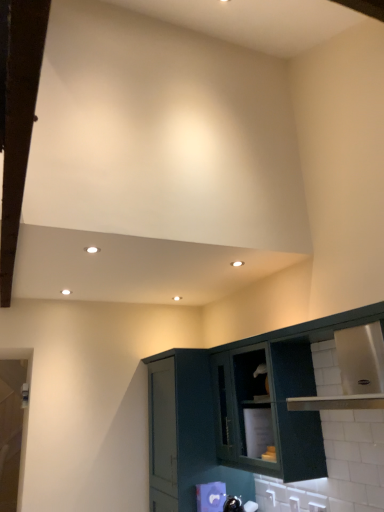
Question: From a real-world perspective, is white plastic electric outlet at lower right, placed as the third electric outlet when sorted from front to back, on stainless steel cabinet at lower right, marked as the 1th cabinetry in a right-to-left arrangement?

Choices:
 (A) yes
 (B) no

Answer: (B)

Question: Is white plastic electric outlet at lower right, the 1th electric outlet when ordered from back to front, oriented towards stainless steel cabinet at lower right, which is the second cabinetry from left to right?

Choices:
 (A) yes
 (B) no

Answer: (A)

Question: Is white plastic electric outlet at lower right, which ranks as the 1th electric outlet in left-to-right order, positioned far away from stainless steel cabinet at lower right, which is the second cabinetry from left to right?

Choices:
 (A) no
 (B) yes

Answer: (A)

Question: From the image's perspective, would you say white plastic electric outlet at lower right, which ranks as the 1th electric outlet in left-to-right order, is shown under stainless steel cabinet at lower right, which is the second cabinetry from left to right?

Choices:
 (A) yes
 (B) no

Answer: (A)

Question: Can you confirm if white plastic electric outlet at lower right, which ranks as the 1th electric outlet in left-to-right order, is bigger than stainless steel cabinet at lower right, marked as the 1th cabinetry in a right-to-left arrangement?

Choices:
 (A) no
 (B) yes

Answer: (A)

Question: Which is correct: green matte cabinet at lower right, the 2th cabinetry in the right-to-left sequence, is inside white plastic electric outlet at lower right, acting as the 3th electric outlet starting from the left, or outside of it?

Choices:
 (A) outside
 (B) inside

Answer: (A)

Question: Considering the positions of point (152, 424) and point (316, 504), is point (152, 424) closer or farther from the camera than point (316, 504)?

Choices:
 (A) farther
 (B) closer

Answer: (A)

Question: Based on their positions, is green matte cabinet at lower right, the 2th cabinetry in the right-to-left sequence, located to the left or right of white plastic electric outlet at lower right, the 1th electric outlet viewed from the front?

Choices:
 (A) right
 (B) left

Answer: (B)

Question: In the image, is green matte cabinet at lower right, which is the 1th cabinetry from left to right, positioned in front of or behind white plastic electric outlet at lower right, acting as the 3th electric outlet starting from the left?

Choices:
 (A) behind
 (B) front

Answer: (A)

Question: Is white plastic electric outlet at lower right, placed as the third electric outlet when sorted from right to left, wider or thinner than white plastic electric outlet at lower right, the 1th electric outlet viewed from the front?

Choices:
 (A) wide
 (B) thin

Answer: (A)

Question: Considering the relative positions of white plastic electric outlet at lower right, which ranks as the 1th electric outlet in left-to-right order, and white plastic electric outlet at lower right, acting as the 3th electric outlet starting from the left, in the image provided, is white plastic electric outlet at lower right, which ranks as the 1th electric outlet in left-to-right order, to the left or to the right of white plastic electric outlet at lower right, acting as the 3th electric outlet starting from the left,?

Choices:
 (A) right
 (B) left

Answer: (B)

Question: Is white plastic electric outlet at lower right, the 1th electric outlet when ordered from back to front, inside or outside of white plastic electric outlet at lower right, acting as the 3th electric outlet starting from the left?

Choices:
 (A) inside
 (B) outside

Answer: (B)

Question: In the image, is white plastic electric outlet at lower right, placed as the third electric outlet when sorted from right to left, positioned in front of or behind white plastic electric outlet at lower right, the 1th electric outlet viewed from the front?

Choices:
 (A) behind
 (B) front

Answer: (A)

Question: From the image's perspective, is stainless steel cabinet at lower right, marked as the 1th cabinetry in a right-to-left arrangement, located above or below white plastic electric outlet at lower right, which is the third electric outlet in back-to-front order?

Choices:
 (A) below
 (B) above

Answer: (B)

Question: In the image, is stainless steel cabinet at lower right, which is the second cabinetry from left to right, on the left side or the right side of white plastic electric outlet at lower right, the 1th electric outlet when ordered from right to left?

Choices:
 (A) right
 (B) left

Answer: (A)